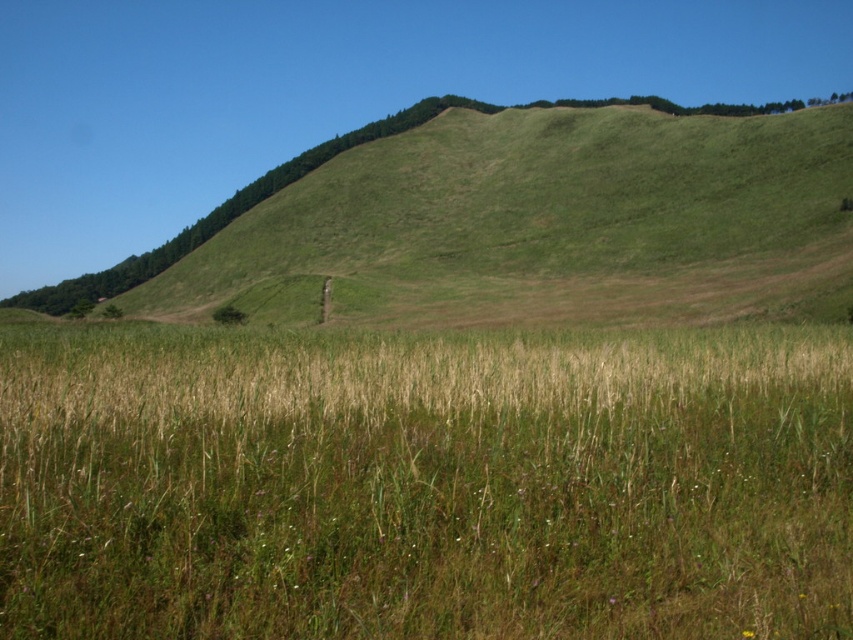
You are standing on the green grass at center and want to walk towards the green grassy hillside at upper center. Which direction should you face to move towards it?

You should face upwards because the green grassy hillside at upper center is further away from you compared to the green grass at center, so moving in the upward direction will take you towards it.

You are standing in the middle of the green grass at center and want to reach the top of the green grassy hillside at upper center. Which direction should you move to ascend the slope?

To ascend the slope towards the green grassy hillside at upper center, you should move upward from the green grass at center since the hillside is positioned higher in the scene.

You are standing at the base of the hill and want to walk towards the green grassy hillside at upper center. Which direction should you walk to reach it from the green grass at center?

To reach the green grassy hillside at upper center from the green grass at center, you should walk to the right since the green grass at center is located to the left of the hillside.